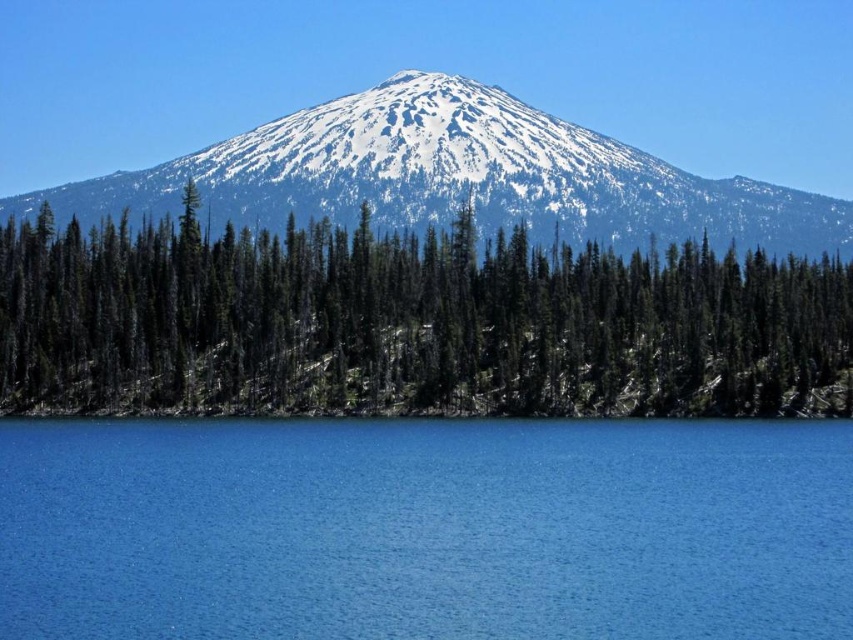
You are a hiker standing at the base of the mountain and want to reach the dense forest of coniferous trees. According to the coordinates provided, where should you head to find the green textured trees at center?

The green textured trees at center are located at coordinates point (409, 324), so you should head towards that point to reach them.

You are standing at the base of the mountain and want to cross to the other side. There is a blue liquid at lower center and green textured trees at center. Can you safely walk directly between them?

The blue liquid at lower center is 167.91 feet away from the green textured trees at center. Since the distance is quite large, walking directly between them might not be safe due to potential obstacles or unstable terrain not visible in the image.